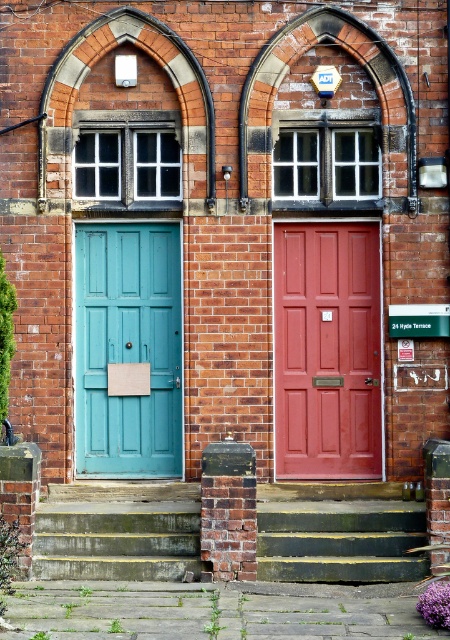
You are a delivery person with a large box that is 1.2 meters wide. You need to deliver it through either the teal matte door at left or the green painted wood stairs at center. Based on their widths, which one can accommodate your box?

The green painted wood stairs at center can accommodate the box since its width is greater than the teal matte door at left, which is too narrow for the 1.2 meter wide box.

Based on the photo, you are standing in front of the brick building with two doors. There are two points marked on the doors. One is at point (297,504) and the other at point (135,516). Which point is closer to you?

Point (135,516) is closer to you because it is less further to the camera than point (297,504).